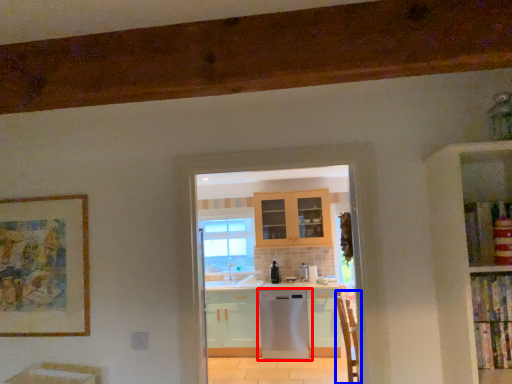
Question: Among these objects, which one is farthest to the camera, home appliance (highlighted by a red box) or armchair (highlighted by a blue box)?

Choices:
 (A) home appliance
 (B) armchair

Answer: (A)